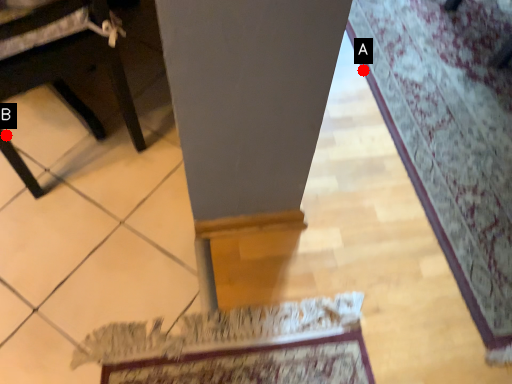
Question: Two points are circled on the image, labeled by A and B beside each circle. Which point appears farthest from the camera in this image?

Choices:
 (A) A is further
 (B) B is further

Answer: (A)